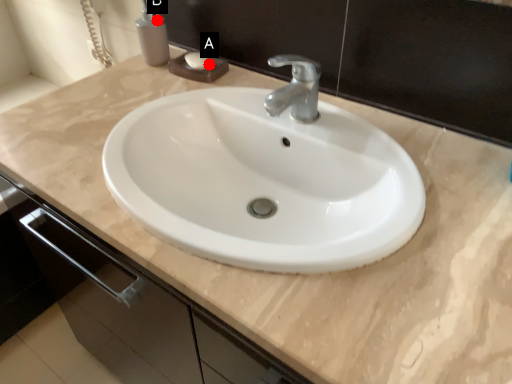
Question: Two points are circled on the image, labeled by A and B beside each circle. Which point appears farthest from the camera in this image?

Choices:
 (A) A is further
 (B) B is further

Answer: (B)